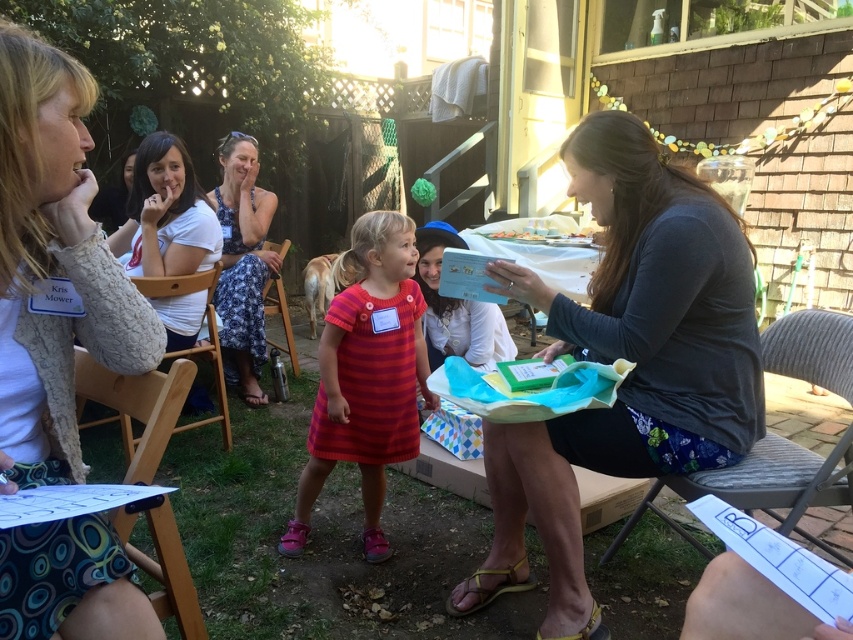
In the scene shown: You are a guest at this outdoor event and want to sit down. You see the white textured cardigan at upper left and the wooden chair at lower left. Which object is closer to you?

The white textured cardigan at upper left is closer to you because it is in front of the wooden chair at lower left.